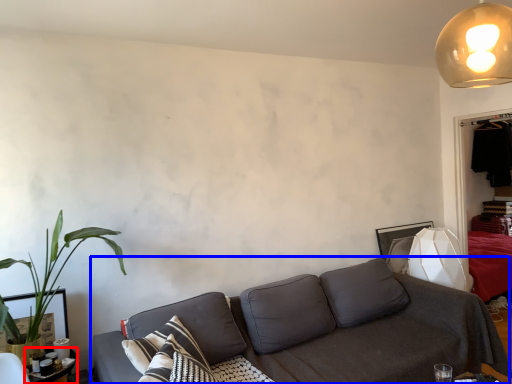
Question: Which object is closer to the camera taking this photo, table (highlighted by a red box) or studio couch (highlighted by a blue box)?

Choices:
 (A) table
 (B) studio couch

Answer: (B)